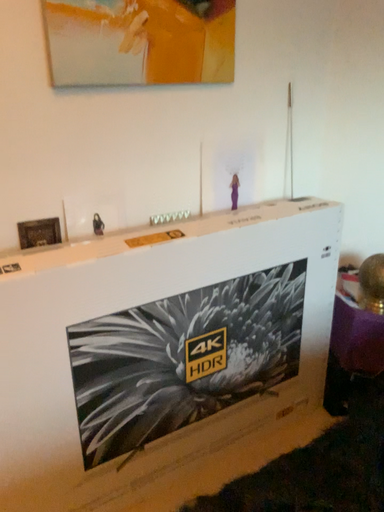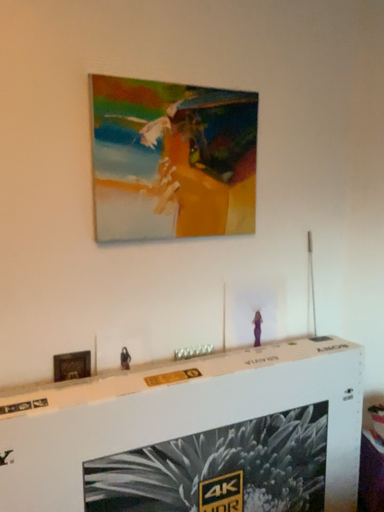
Question: How did the camera likely rotate when shooting the video?

Choices:
 (A) rotated downward
 (B) rotated upward

Answer: (B)